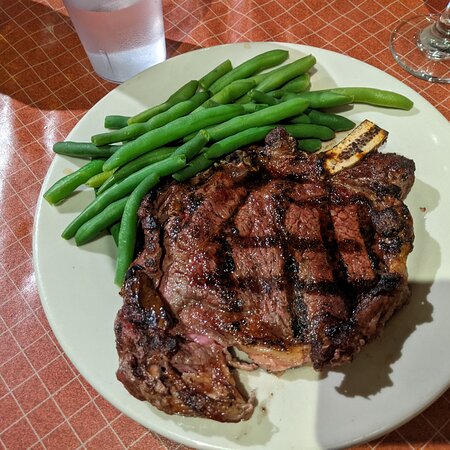
At what (x,y) coordinates should I click in order to perform the action: click on white plate. Please return your answer as a coordinate pair (x, y). The image size is (450, 450). Looking at the image, I should click on (82, 301).